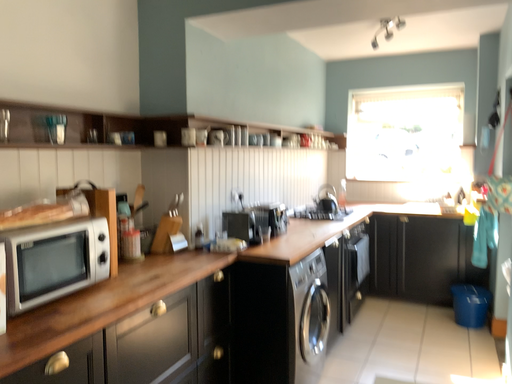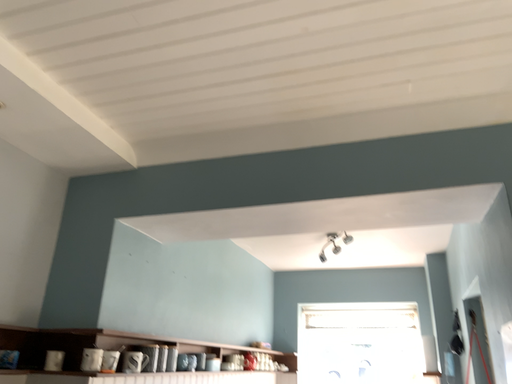
Question: How did the camera likely rotate when shooting the video?

Choices:
 (A) rotated right
 (B) rotated left

Answer: (A)